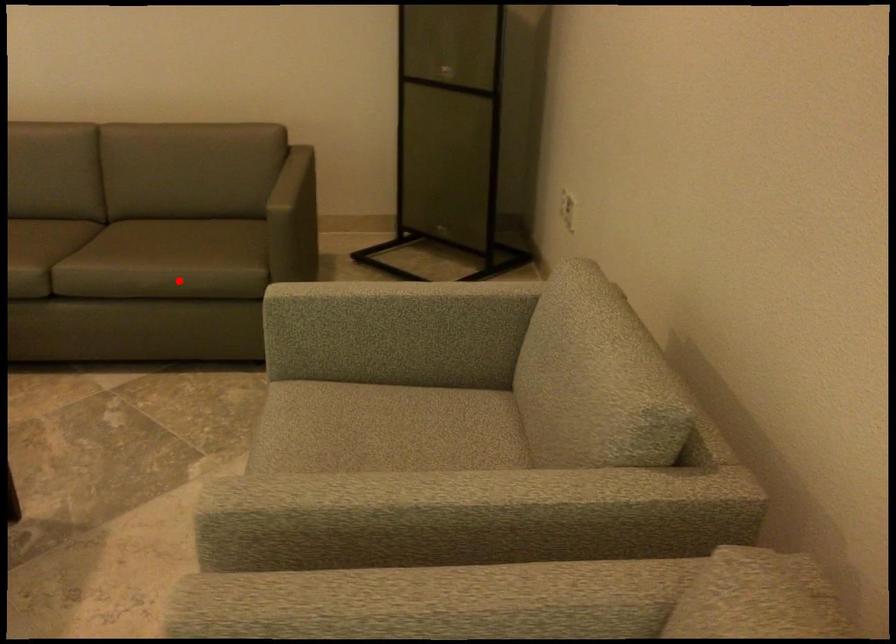
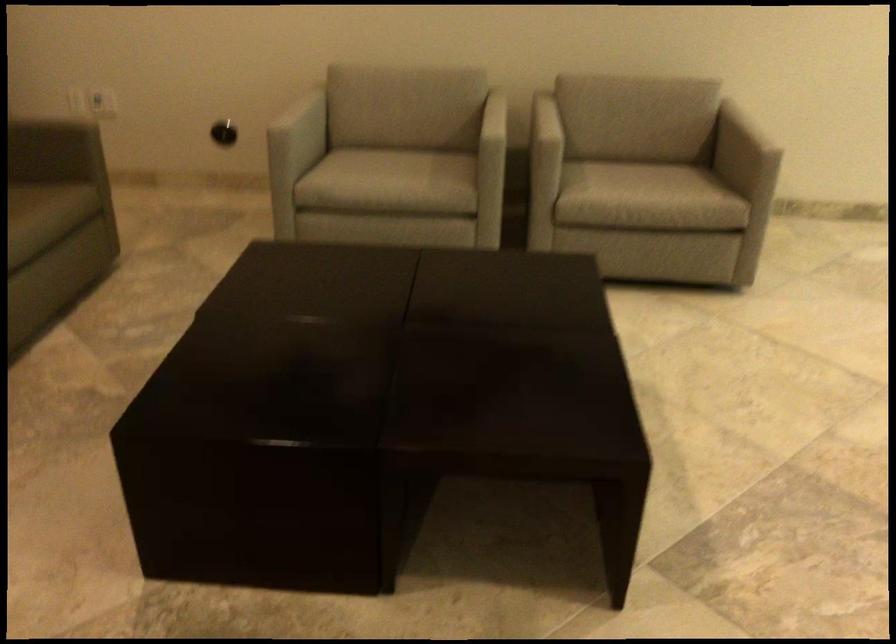
Locate, in the second image, the point that corresponds to the highlighted location in the first image.

(36, 219)